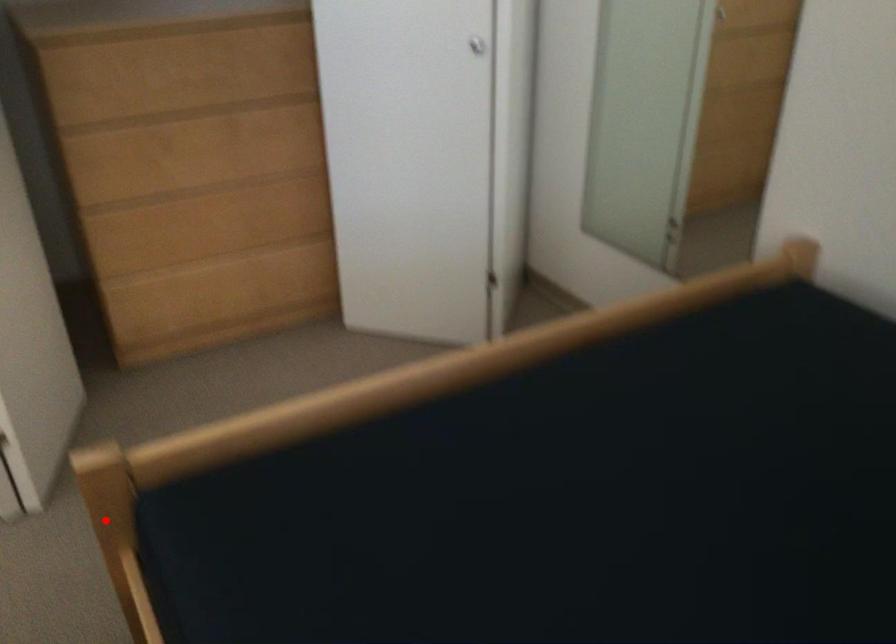
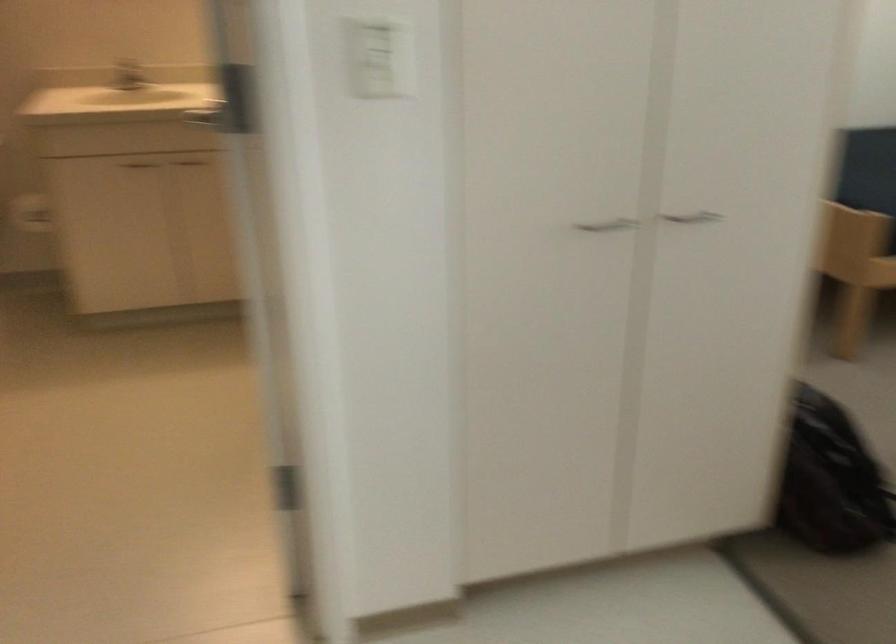
Locate, in the second image, the point that corresponds to the highlighted location in the first image.

(855, 269)